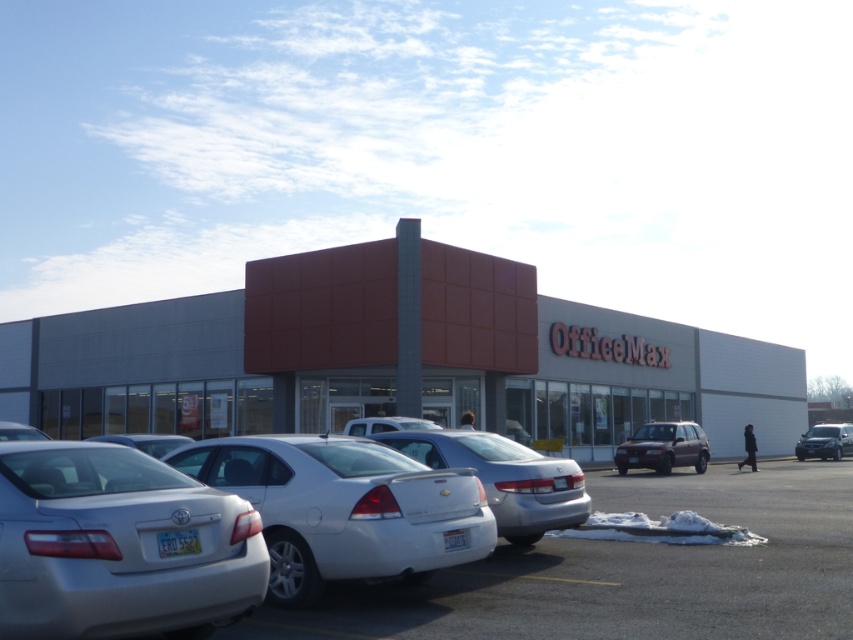
You are a customer arriving at the OfficeMax store and need to park your car. You see a metallic silver car at lower left and a white matte car at center. Which car is positioned closer to the right side of the parking lot?

The metallic silver car at lower left is to the right of white matte car at center, so it is closer to the right side of the parking lot.

You are a delivery driver who needs to park your truck between the satin black suv at right and the white matte car at center. Is there enough space between them to fit your truck which is 2 meters wide?

The satin black suv at right is positioned on the right side of white matte car at center. However, the exact distance between them isn not provided in the scene description. Therefore, it is impossible to determine if there is enough space for the truck.

You are standing at the center of the parking lot in front of the OfficeMax store. You see a metallic silver car at lower left. Can you estimate its 2D coordinates in the image?

The metallic silver car at lower left is located at coordinates approximately 0.894 in the x direction and 0.739 in the y direction.